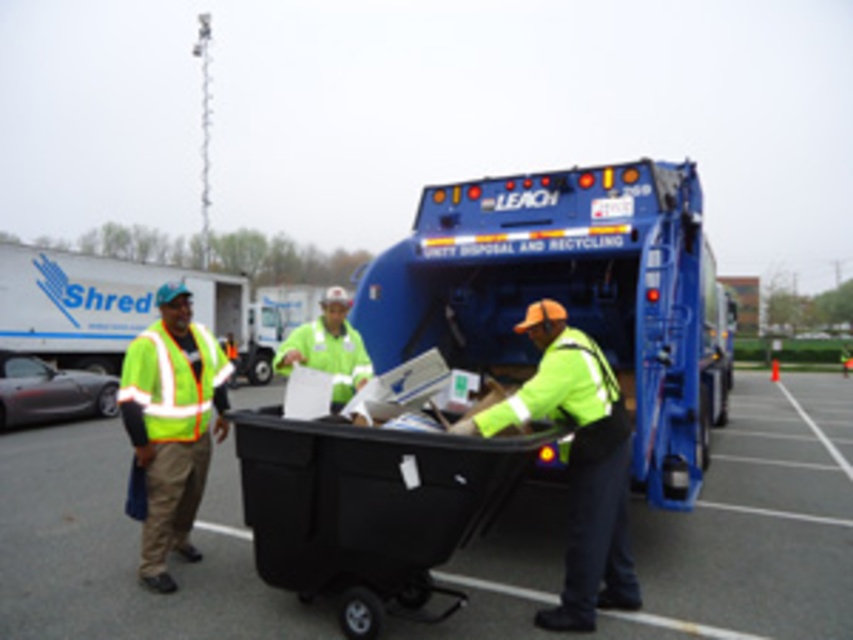
Question: Is neon yellow reflective vest at center to the right of high-visibility yellow safety vest at left from the viewer's perspective?

Choices:
 (A) yes
 (B) no

Answer: (A)

Question: Is blue metallic garbage truck at center closer to camera compared to high-visibility yellow safety vest at left?

Choices:
 (A) no
 (B) yes

Answer: (B)

Question: Which point appears farthest from the camera in this image?

Choices:
 (A) (384, 452)
 (B) (151, 529)

Answer: (B)

Question: Among these objects, which one is nearest to the camera?

Choices:
 (A) high-visibility yellow safety vest at left
 (B) high-visibility fabric worker at left

Answer: (B)

Question: Is black plastic bin at center above neon yellow reflective vest at center?

Choices:
 (A) no
 (B) yes

Answer: (A)

Question: Which of the following is the farthest from the observer?

Choices:
 (A) black plastic recycling bin at center
 (B) green reflective vest at center
 (C) blue metallic garbage truck at center

Answer: (B)